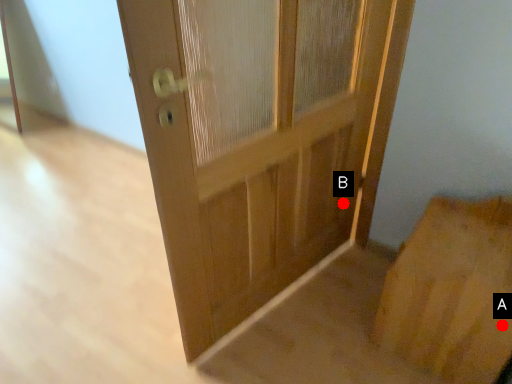
Question: Two points are circled on the image, labeled by A and B beside each circle. Which point appears farthest from the camera in this image?

Choices:
 (A) A is further
 (B) B is further

Answer: (B)